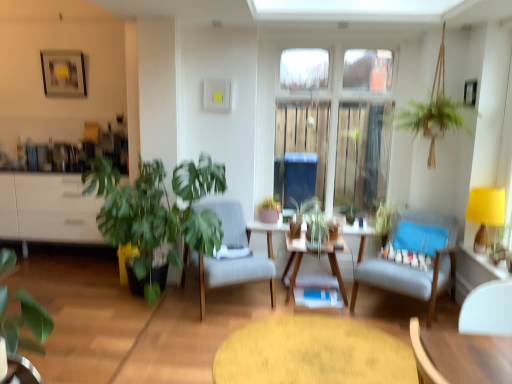
Where is `white glossy cabinet at left`? white glossy cabinet at left is located at coordinates (48, 209).

The image size is (512, 384). What are the coordinates of `matte pink pot at center, the third houseplant positioned from the left` in the screenshot? It's located at click(269, 210).

Image resolution: width=512 pixels, height=384 pixels. I want to click on yellow fabric lampshade at right, so click(485, 213).

How much space does green matte plant at lower left, the third houseplant positioned from the right, occupy vertically?

green matte plant at lower left, the third houseplant positioned from the right, is 27.63 inches tall.

In order to click on wooden round table at center in this screenshot , I will do `click(313, 353)`.

This screenshot has width=512, height=384. Find the location of `white glossy cabinet at left`. white glossy cabinet at left is located at coordinates (48, 209).

Does light gray fabric chair at center, the first chair when ordered from left to right, lie in front of green matte plant at lower left, which ranks as the first houseplant in front-to-back order?

No, it is behind green matte plant at lower left, which ranks as the first houseplant in front-to-back order.

Does point (231, 208) appear closer or farther from the camera than point (22, 345)?

Point (231, 208) is farther from the camera than point (22, 345).

Considering the relative positions of light gray fabric chair at center, the first chair when ordered from left to right, and green matte plant at lower left, which ranks as the first houseplant in front-to-back order, in the image provided, is light gray fabric chair at center, the first chair when ordered from left to right, to the left or to the right of green matte plant at lower left, which ranks as the first houseplant in front-to-back order,?

Clearly, light gray fabric chair at center, the first chair when ordered from left to right, is on the right of green matte plant at lower left, which ranks as the first houseplant in front-to-back order, in the image.

Who is bigger, light gray fabric chair at center, the second chair viewed from the right, or green matte plant at lower left, the third houseplant positioned from the right?

light gray fabric chair at center, the second chair viewed from the right, is bigger.

Can you see yellow fabric lampshade at right touching wooden table at right, which is counted as the second table, starting from the left?

No, yellow fabric lampshade at right is not in contact with wooden table at right, which is counted as the second table, starting from the left.

How distant is yellow fabric lampshade at right from wooden table at right, positioned as the first table in right-to-left order?

yellow fabric lampshade at right and wooden table at right, positioned as the first table in right-to-left order, are 12.34 inches apart from each other.

In the scene shown: Would you say yellow fabric lampshade at right is inside or outside wooden table at right, the 1th table viewed from the front?

yellow fabric lampshade at right is spatially situated outside wooden table at right, the 1th table viewed from the front.

Can you confirm if yellow fabric lampshade at right is positioned to the left of wooden table at right, which is the 2th table in back-to-front order?

In fact, yellow fabric lampshade at right is to the right of wooden table at right, which is the 2th table in back-to-front order.

In terms of height, does matte black picture frame at upper left look taller or shorter compared to green leafy plant at left, positioned as the second houseplant in front-to-back order?

Considering their sizes, matte black picture frame at upper left has less height than green leafy plant at left, positioned as the second houseplant in front-to-back order.

Does point (69, 74) appear closer or farther from the camera than point (197, 169)?

Point (69, 74) appears to be farther away from the viewer than point (197, 169).

Is matte black picture frame at upper left oriented towards green leafy plant at left, the 2th houseplant viewed from the right?

No, matte black picture frame at upper left does not turn towards green leafy plant at left, the 2th houseplant viewed from the right.

Which object is positioned more to the right, matte black picture frame at upper left or green leafy plant at left, the 2th houseplant viewed from the right?

From the viewer's perspective, green leafy plant at left, the 2th houseplant viewed from the right, appears more on the right side.

Is white glossy cabinet at left not near matte black picture frame at upper left?

Yes, white glossy cabinet at left and matte black picture frame at upper left are quite far apart.

Which is correct: white glossy cabinet at left is inside matte black picture frame at upper left, or outside of it?

white glossy cabinet at left cannot be found inside matte black picture frame at upper left.

Measure the distance between white glossy cabinet at left and matte black picture frame at upper left.

1.17 meters.

From their relative heights in the image, would you say white glossy cabinet at left is taller or shorter than matte black picture frame at upper left?

Considering their sizes, white glossy cabinet at left has more height than matte black picture frame at upper left.

From the image's perspective, relative to green matte plant at lower left, which appears as the 1th houseplant when viewed from the left, is matte black picture frame at upper left above or below?

Based on their image positions, matte black picture frame at upper left is located above green matte plant at lower left, which appears as the 1th houseplant when viewed from the left.

Is matte black picture frame at upper left spatially inside green matte plant at lower left, the third houseplant positioned from the right, or outside of it?

matte black picture frame at upper left lies outside green matte plant at lower left, the third houseplant positioned from the right.

From the picture: Can you tell me how much matte black picture frame at upper left and green matte plant at lower left, which ranks as the first houseplant in front-to-back order, differ in facing direction?

177 degrees separate the facing orientations of matte black picture frame at upper left and green matte plant at lower left, which ranks as the first houseplant in front-to-back order.

Does matte black picture frame at upper left turn towards green matte plant at lower left, which appears as the 1th houseplant when viewed from the left?

Yes, matte black picture frame at upper left is oriented towards green matte plant at lower left, which appears as the 1th houseplant when viewed from the left.

From the image's perspective, is wooden round table at center positioned above or below white glossy cabinet at left?

wooden round table at center is situated lower than white glossy cabinet at left in the image.

Does wooden round table at center turn towards white glossy cabinet at left?

No, wooden round table at center is not oriented towards white glossy cabinet at left.

Would you consider wooden round table at center to be distant from white glossy cabinet at left?

wooden round table at center is positioned a significant distance from white glossy cabinet at left.

From a real-world perspective, who is located lower, wooden round table at center or white glossy cabinet at left?

wooden round table at center, from a real-world perspective.

Considering the sizes of wooden table at center, positioned as the 2th table in front-to-back order, and green leafy plant at left, marked as the 2th houseplant in a left-to-right arrangement, in the image, is wooden table at center, positioned as the 2th table in front-to-back order, wider or thinner than green leafy plant at left, marked as the 2th houseplant in a left-to-right arrangement,?

Clearly, wooden table at center, positioned as the 2th table in front-to-back order, has less width compared to green leafy plant at left, marked as the 2th houseplant in a left-to-right arrangement.

Considering the sizes of objects wooden table at center, which is the 1th table in back-to-front order, and green leafy plant at left, the 2th houseplant viewed from the right, in the image provided, who is taller, wooden table at center, which is the 1th table in back-to-front order, or green leafy plant at left, the 2th houseplant viewed from the right,?

green leafy plant at left, the 2th houseplant viewed from the right.

Based on their sizes in the image, would you say wooden table at center, positioned as the 2th table in front-to-back order, is bigger or smaller than green leafy plant at left, marked as the 2th houseplant in a left-to-right arrangement?

wooden table at center, positioned as the 2th table in front-to-back order, is smaller than green leafy plant at left, marked as the 2th houseplant in a left-to-right arrangement.

Are wooden table at center, marked as the first table in a left-to-right arrangement, and green leafy plant at left, the 2th houseplant in the back-to-front sequence, beside each other?

No, wooden table at center, marked as the first table in a left-to-right arrangement, is not next to green leafy plant at left, the 2th houseplant in the back-to-front sequence.

From the image's perspective, which chair is the 1st one below the green matte plant at lower left, which appears as the 1th houseplant when viewed from the left? Please provide its 2D coordinates.

[(231, 271)]

The width and height of the screenshot is (512, 384). In order to click on lamp on the right of wooden table at right, which is counted as the second table, starting from the left in this screenshot , I will do `click(485, 213)`.

Which object lies nearer to the anchor point green matte plant at lower left, which appears as the 1th houseplant when viewed from the left, matte black picture frame at upper left or yellow fabric lampshade at right?

Among the two, yellow fabric lampshade at right is located nearer to green matte plant at lower left, which appears as the 1th houseplant when viewed from the left.

Estimate the real-world distances between objects in this image. Which object is further from light gray fabric chair at center, the second chair viewed from the right, white glossy cabinet at left or green matte plant at lower left, the third houseplant positioned from the right?

white glossy cabinet at left is positioned further to the anchor light gray fabric chair at center, the second chair viewed from the right.

Estimate the real-world distances between objects in this image. Which object is closer to clear glass window at center, yellow fabric lampshade at right or wooden table at right, which is the 2th table in back-to-front order?

Based on the image, yellow fabric lampshade at right appears to be nearer to clear glass window at center.

Considering their positions, is light gray fabric chair at center, the first chair when ordered from left to right, positioned further to wooden round table at center than clear glass window at center?

The object further to wooden round table at center is clear glass window at center.

Looking at the image, which one is located closer to green leafy plant at left, marked as the 2th houseplant in a left-to-right arrangement, light blue fabric chair at center right, which is counted as the first chair, starting from the right, or light gray fabric chair at center, the second chair viewed from the right?

The object closer to green leafy plant at left, marked as the 2th houseplant in a left-to-right arrangement, is light gray fabric chair at center, the second chair viewed from the right.

Estimate the real-world distances between objects in this image. Which object is closer to wooden table at right, positioned as the first table in right-to-left order, clear glass window at center or light blue fabric chair at center right, which is counted as the first chair, starting from the right?

The object closer to wooden table at right, positioned as the first table in right-to-left order, is light blue fabric chair at center right, which is counted as the first chair, starting from the right.

When comparing their distances from green matte plant at lower left, which ranks as the first houseplant in front-to-back order, does green leafy plant at left, the 2th houseplant in the back-to-front sequence, or matte black picture frame at upper left seem further?

matte black picture frame at upper left.

Estimate the real-world distances between objects in this image. Which object is closer to matte pink pot at center, the third houseplant positioned from the left, green matte plant at lower left, which appears as the 1th houseplant when viewed from the left, or wooden table at center, which is the 1th table in back-to-front order?

Based on the image, wooden table at center, which is the 1th table in back-to-front order, appears to be nearer to matte pink pot at center, the third houseplant positioned from the left.

You are a GUI agent. You are given a task and a screenshot of the screen. Output one action in this format:
    pyautogui.click(x=<x>, y=<y>)
    Task: Click on the coffee table between matte black picture frame at upper left and wooden table at right, positioned as the first table in right-to-left order, in the horizontal direction
    The height and width of the screenshot is (384, 512).
    Given the screenshot: What is the action you would take?
    pyautogui.click(x=313, y=353)

In order to click on chair between white glossy cabinet at left and wooden table at center, positioned as the 2th table in front-to-back order in this screenshot , I will do `click(231, 271)`.

Locate an element on the screen. This screenshot has height=384, width=512. picture frame situated between white glossy cabinet at left and matte pink pot at center, which is the first houseplant in right-to-left order, from left to right is located at coordinates (63, 73).

Find the location of a particular element. The width and height of the screenshot is (512, 384). table between clear glass window at center and light blue fabric chair at center right, which is counted as the first chair, starting from the right, vertically is located at coordinates (474, 272).